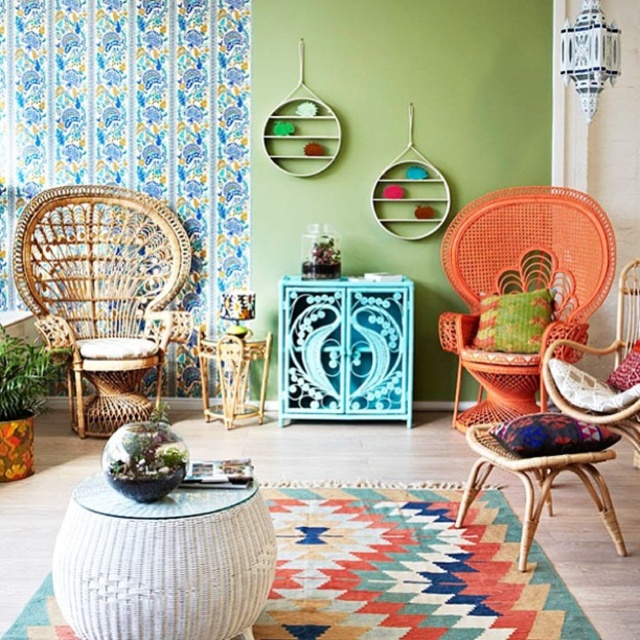
You are standing in the living room and want to place a small plant on the nearest surface to the point at coordinates (102, 292). Which object should you choose?

The point at coordinates (102, 292) is on the rattan wooden rocking chair at left, so the nearest surface would be the seat of the rattan wooden rocking chair at left where the point is located. However, if you prefer a more stable surface, the turquoise cabinet in the center is also nearby.